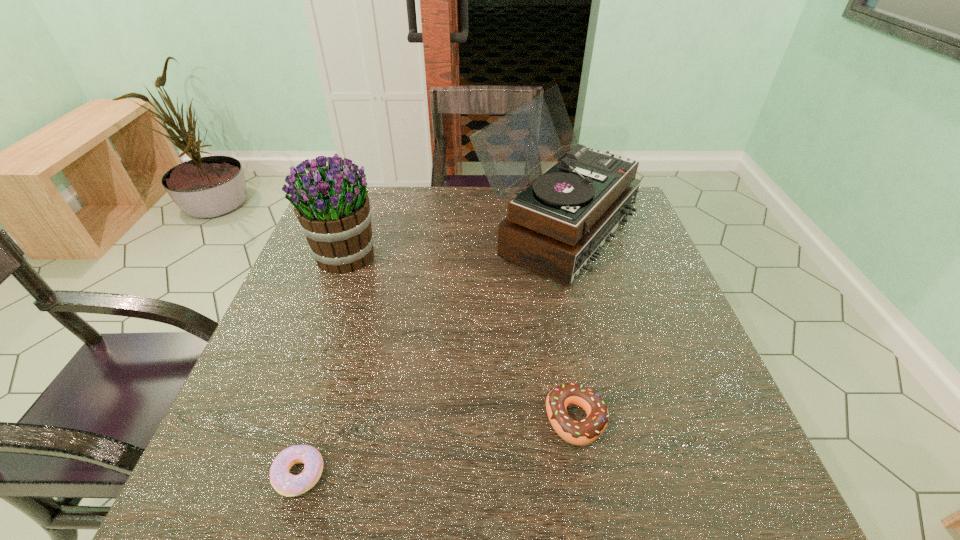
In order to click on vacant area that lies between the nearer doughnut and the third shortest object in this screenshot , I will do `click(323, 364)`.

Identify the location of vacant point located between the bouquet and the third tallest object. This screenshot has width=960, height=540. (461, 338).

Where is `object that is the second closest to the record player`? object that is the second closest to the record player is located at coordinates (584, 432).

Select which object is the third closest to the left doughnut. Please provide its 2D coordinates. Your answer should be formatted as a tuple, i.e. [(x, y)], where the tuple contains the x and y coordinates of a point satisfying the conditions above.

[(557, 225)]

I want to click on free space that satisfies the following two spatial constraints: 1. on the back side of the record player; 2. on the right side of the third shortest object, so click(354, 231).

The image size is (960, 540). In order to click on vacant area that satisfies the following two spatial constraints: 1. on the back side of the record player; 2. on the left side of the second tallest object in this screenshot , I will do `click(354, 231)`.